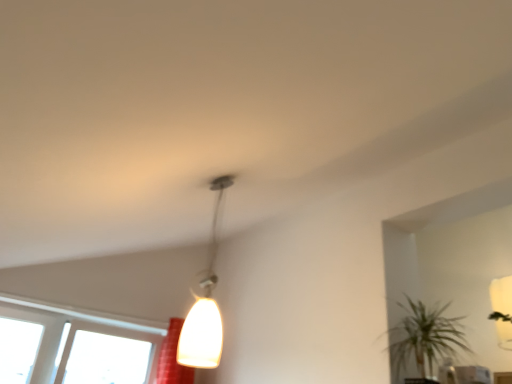
Question: Does green leafy plant at lower right have a smaller size compared to white glossy pendant light at center?

Choices:
 (A) yes
 (B) no

Answer: (B)

Question: Is white glossy pendant light at center at the back of green leafy plant at lower right?

Choices:
 (A) yes
 (B) no

Answer: (B)

Question: From the image's perspective, is green leafy plant at lower right under white glossy pendant light at center?

Choices:
 (A) yes
 (B) no

Answer: (A)

Question: Could white glossy pendant light at center be considered to be inside green leafy plant at lower right?

Choices:
 (A) yes
 (B) no

Answer: (B)

Question: Is green leafy plant at lower right positioned behind white glossy pendant light at center?

Choices:
 (A) no
 (B) yes

Answer: (B)

Question: From a real-world perspective, relative to green leafy plant at lower right, is transparent glass window at lower left vertically above or below?

Choices:
 (A) below
 (B) above

Answer: (A)

Question: Looking at the image, does transparent glass window at lower left seem bigger or smaller compared to green leafy plant at lower right?

Choices:
 (A) big
 (B) small

Answer: (A)

Question: Does point (74, 354) appear closer or farther from the camera than point (438, 314)?

Choices:
 (A) farther
 (B) closer

Answer: (A)

Question: Is transparent glass window at lower left to the left or to the right of green leafy plant at lower right in the image?

Choices:
 (A) left
 (B) right

Answer: (A)

Question: In terms of height, does white glossy pendant light at center look taller or shorter compared to green leafy plant at lower right?

Choices:
 (A) short
 (B) tall

Answer: (B)

Question: From a real-world perspective, is white glossy pendant light at center above or below green leafy plant at lower right?

Choices:
 (A) below
 (B) above

Answer: (B)

Question: Is white glossy pendant light at center bigger or smaller than green leafy plant at lower right?

Choices:
 (A) big
 (B) small

Answer: (B)

Question: Based on their positions, is white glossy pendant light at center located to the left or right of green leafy plant at lower right?

Choices:
 (A) left
 (B) right

Answer: (A)

Question: In terms of size, does transparent glass window at lower left appear bigger or smaller than white glossy pendant light at center?

Choices:
 (A) small
 (B) big

Answer: (B)

Question: Is point (25, 322) closer or farther from the camera than point (179, 340)?

Choices:
 (A) closer
 (B) farther

Answer: (B)